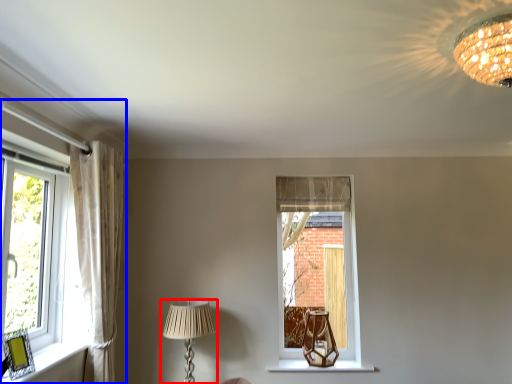
Question: Which point is further to the camera, lamp (highlighted by a red box) or window (highlighted by a blue box)?

Choices:
 (A) lamp
 (B) window

Answer: (A)